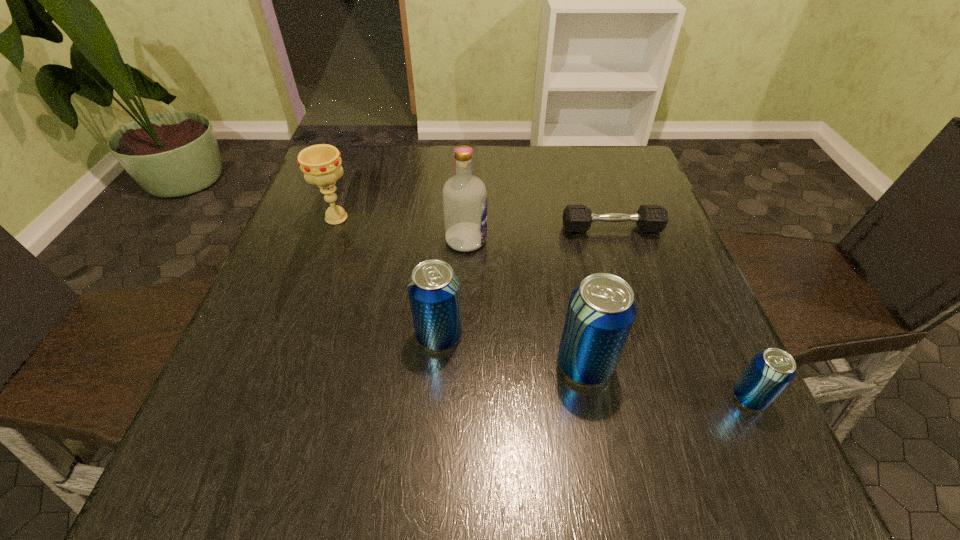
Where is `the leftmost beer can`? the leftmost beer can is located at coordinates (434, 289).

Where is `the second beer can from left to right`? The width and height of the screenshot is (960, 540). the second beer can from left to right is located at coordinates (601, 311).

Locate an element on the screen. This screenshot has width=960, height=540. the fifth tallest object is located at coordinates (770, 371).

I want to click on the rightmost beer can, so click(770, 371).

Locate an element on the screen. The height and width of the screenshot is (540, 960). the leftmost object is located at coordinates (321, 164).

The height and width of the screenshot is (540, 960). I want to click on the tallest object, so click(x=464, y=195).

Image resolution: width=960 pixels, height=540 pixels. I want to click on dumbbell, so click(576, 218).

Locate an element on the screen. vacant space located 0.170m on the right of the second shortest beer can is located at coordinates (553, 335).

This screenshot has height=540, width=960. Find the location of `vacant space located on the left of the second beer can from left to right`. vacant space located on the left of the second beer can from left to right is located at coordinates (500, 364).

In order to click on free space located on the back of the shortest beer can in this screenshot , I will do `click(684, 258)`.